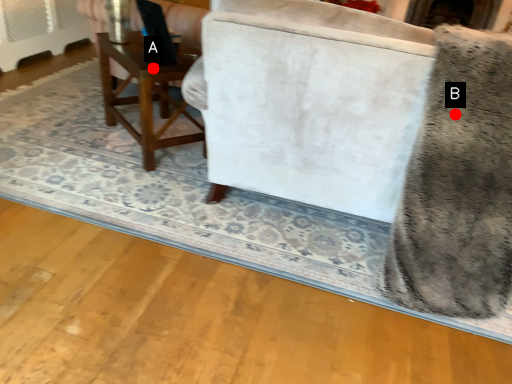
Question: Two points are circled on the image, labeled by A and B beside each circle. Which of the following is the closest to the observer?

Choices:
 (A) A is closer
 (B) B is closer

Answer: (B)